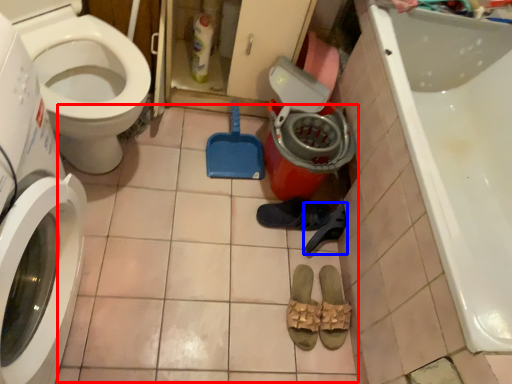
Question: Which object is closer to the camera taking this photo, tile (highlighted by a red box) or shoe (highlighted by a blue box)?

Choices:
 (A) tile
 (B) shoe

Answer: (A)